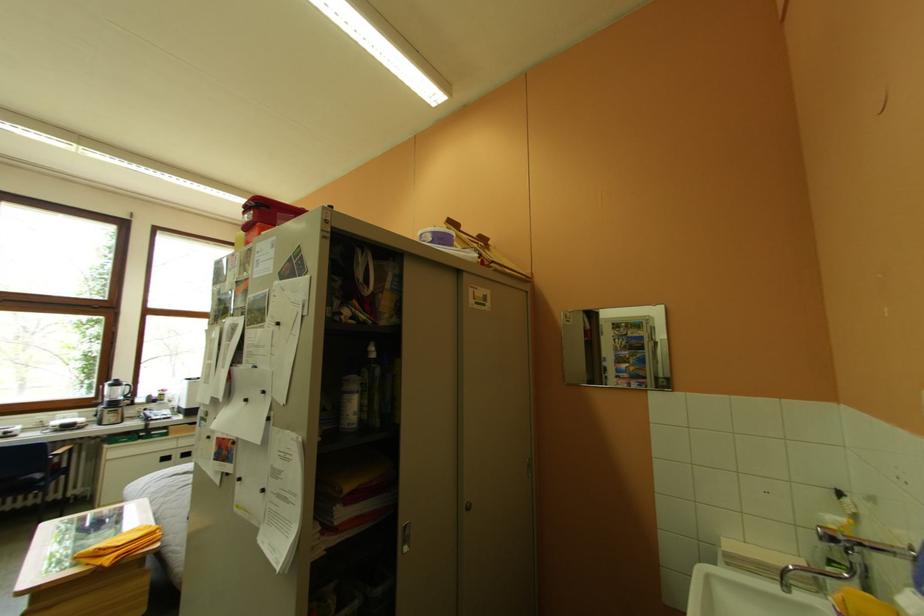
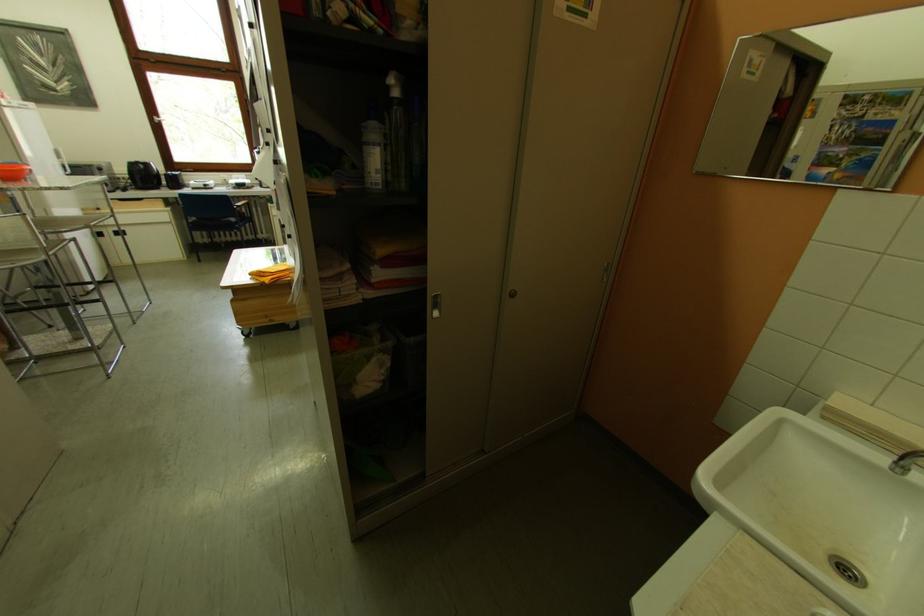
How did the camera likely rotate?

The rotation direction of the camera is left-down.